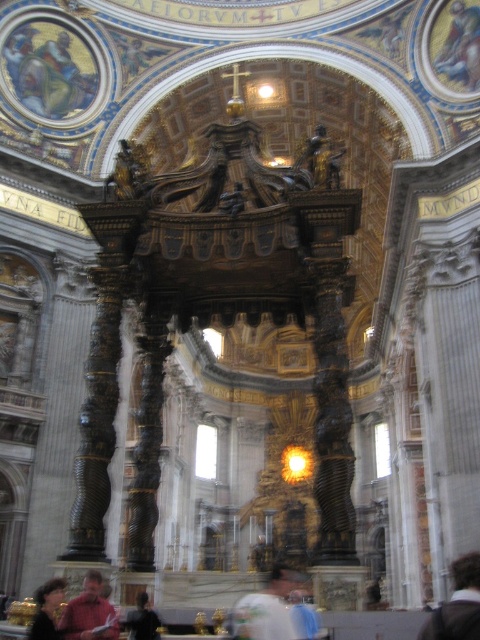
Who is positioned more to the left, light brown leather jacket at lower right or dark brown leather jacket at lower center?

dark brown leather jacket at lower center is more to the left.

Does light brown leather jacket at lower right appear over dark brown leather jacket at lower center?

Yes, light brown leather jacket at lower right is above dark brown leather jacket at lower center.

Does point (475, 621) lie in front of point (144, 609)?

Yes, point (475, 621) is in front of point (144, 609).

Where is `light brown leather jacket at lower right`? This screenshot has height=640, width=480. light brown leather jacket at lower right is located at coordinates (457, 604).

Who is positioned more to the right, white matte shirt at lower center or light brown leather jacket at lower right?

From the viewer's perspective, light brown leather jacket at lower right appears more on the right side.

Can you confirm if white matte shirt at lower center is shorter than light brown leather jacket at lower right?

Incorrect, white matte shirt at lower center's height does not fall short of light brown leather jacket at lower right's.

What do you see at coordinates (265, 611) in the screenshot?
I see `white matte shirt at lower center` at bounding box center [265, 611].

Find the location of a particular element. white matte shirt at lower center is located at coordinates (265, 611).

Locate an element on the screen. The image size is (480, 640). red shirt at lower left is located at coordinates (90, 612).

Who is more forward, (x=90, y=634) or (x=126, y=618)?

Point (x=90, y=634)

At what (x,y) coordinates should I click in order to perform the action: click on red shirt at lower left. Please return your answer as a coordinate pair (x, y). Looking at the image, I should click on (90, 612).